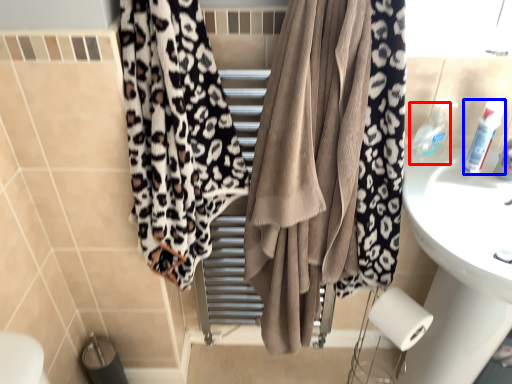
Question: Which object is further to the camera taking this photo, toiletry (highlighted by a red box) or toiletry (highlighted by a blue box)?

Choices:
 (A) toiletry
 (B) toiletry

Answer: (A)